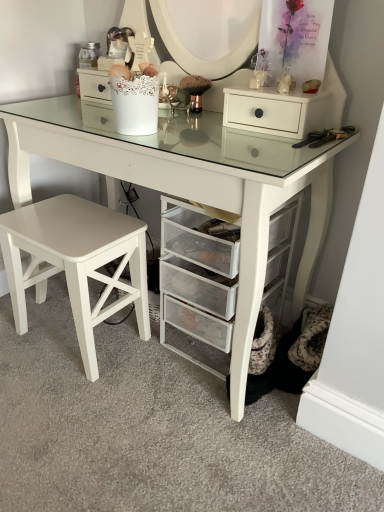
Measure the distance between point (6, 269) and camera.

Point (6, 269) is 1.34 meters from camera.

In order to click on white glossy table at center in this screenshot , I will do `click(190, 183)`.

How much distance is there between clear mesh drawers at center and white matte drawer at upper right?

A distance of 15.54 inches exists between clear mesh drawers at center and white matte drawer at upper right.

The height and width of the screenshot is (512, 384). Find the location of `shelf on the left of white matte drawer at upper right`. shelf on the left of white matte drawer at upper right is located at coordinates (196, 278).

Is clear mesh drawers at center facing towards white matte drawer at upper right?

No, clear mesh drawers at center is not turned towards white matte drawer at upper right.

Does clear mesh drawers at center have a lesser width compared to white matte drawer at upper right?

Incorrect, the width of clear mesh drawers at center is not less than that of white matte drawer at upper right.

Find the location of a particular element. shelf that is under the white glossy table at center (from a real-world perspective) is located at coordinates (196, 278).

Is white glossy table at center closer to camera compared to clear mesh drawers at center?

That is True.

From a real-world perspective, is white glossy table at center under clear mesh drawers at center?

No, from a real-world perspective, white glossy table at center is not beneath clear mesh drawers at center.

In the scene shown: Is white glossy table at center far from clear mesh drawers at center?

They are positioned close to each other.

Which object is thinner, white matte stool at lower left or white glossy table at center?

white matte stool at lower left is thinner.

Is white matte stool at lower left positioned before white glossy table at center?

No, white matte stool at lower left is further to the viewer.

Is white matte stool at lower left to the left of white glossy table at center from the viewer's perspective?

Yes, white matte stool at lower left is to the left of white glossy table at center.

Is white matte stool at lower left not within white glossy table at center?

No, white matte stool at lower left is not entirely external to white glossy table at center.

Based on the photo, from a real-world perspective, who is located higher, white glossy table at center or white matte drawer at upper right?

white matte drawer at upper right.

Would you say white glossy table at center is inside or outside white matte drawer at upper right?

white glossy table at center cannot be found inside white matte drawer at upper right.

Is white glossy table at center thinner than white matte drawer at upper right?

In fact, white glossy table at center might be wider than white matte drawer at upper right.

How distant is white matte drawer at upper right from clear mesh drawers at center?

white matte drawer at upper right is 15.54 inches from clear mesh drawers at center.

From the image's perspective, is white matte drawer at upper right above or below clear mesh drawers at center?

white matte drawer at upper right is situated higher than clear mesh drawers at center in the image.

Considering the relative sizes of white matte drawer at upper right and clear mesh drawers at center in the image provided, is white matte drawer at upper right thinner than clear mesh drawers at center?

Indeed, white matte drawer at upper right has a lesser width compared to clear mesh drawers at center.

Image resolution: width=384 pixels, height=512 pixels. What are the coordinates of `chest of drawers in front of the clear mesh drawers at center` in the screenshot? It's located at (277, 111).

How far apart are clear mesh drawers at center and white matte stool at lower left?

clear mesh drawers at center and white matte stool at lower left are 10.43 inches apart.

From the image's perspective, who appears lower, clear mesh drawers at center or white matte stool at lower left?

white matte stool at lower left is shown below in the image.

Is clear mesh drawers at center facing away from white matte stool at lower left?

clear mesh drawers at center does not have its back to white matte stool at lower left.

Is point (198, 265) less distant than point (76, 223)?

Yes, point (198, 265) is closer to viewer.

In the scene shown: Is white matte drawer at upper right not close to white matte stool at lower left?

Actually, white matte drawer at upper right and white matte stool at lower left are a little close together.

Is white matte stool at lower left surrounded by white matte drawer at upper right?

Actually, white matte stool at lower left is outside white matte drawer at upper right.

Is white matte drawer at upper right to the right of white matte stool at lower left from the viewer's perspective?

Yes, white matte drawer at upper right is to the right of white matte stool at lower left.

From the picture: Can you confirm if white matte drawer at upper right is smaller than white matte stool at lower left?

Yes, white matte drawer at upper right is smaller than white matte stool at lower left.

Where is `shelf behind the white matte drawer at upper right`? This screenshot has height=512, width=384. shelf behind the white matte drawer at upper right is located at coordinates (196, 278).

The image size is (384, 512). Identify the location of table that is in front of the clear mesh drawers at center. (190, 183).

Considering their positions, is clear mesh drawers at center positioned closer to white matte stool at lower left than white glossy table at center?

clear mesh drawers at center is closer to white matte stool at lower left.

Estimate the real-world distances between objects in this image. Which object is further from white matte drawer at upper right, white matte stool at lower left or clear mesh drawers at center?

The object further to white matte drawer at upper right is white matte stool at lower left.

Consider the image. From the image, which object appears to be nearer to white glossy table at center, white matte drawer at upper right or white matte stool at lower left?

white matte drawer at upper right is closer to white glossy table at center.

Considering their positions, is white glossy table at center positioned closer to white matte drawer at upper right than clear mesh drawers at center?

white glossy table at center.

From the image, which object appears to be farther from clear mesh drawers at center, white matte stool at lower left or white glossy table at center?

white matte stool at lower left lies further to clear mesh drawers at center than the other object.

Which object lies nearer to the anchor point white glossy table at center, clear mesh drawers at center or white matte drawer at upper right?

Based on the image, clear mesh drawers at center appears to be nearer to white glossy table at center.

Looking at the image, which one is located further to clear mesh drawers at center, white matte stool at lower left or white matte drawer at upper right?

Among the two, white matte drawer at upper right is located further to clear mesh drawers at center.

Based on the photo, considering their positions, is white matte drawer at upper right positioned closer to white glossy table at center than clear mesh drawers at center?

The object closer to white glossy table at center is clear mesh drawers at center.

Locate an element on the screen. The image size is (384, 512). table between white matte stool at lower left and clear mesh drawers at center is located at coordinates point(190,183).

I want to click on table between white matte stool at lower left and white matte drawer at upper right, so click(x=190, y=183).

Find the location of a particular element. table between white matte drawer at upper right and clear mesh drawers at center in the vertical direction is located at coordinates (190, 183).

Locate an element on the screen. Image resolution: width=384 pixels, height=512 pixels. shelf between white matte stool at lower left and white matte drawer at upper right from left to right is located at coordinates (196, 278).